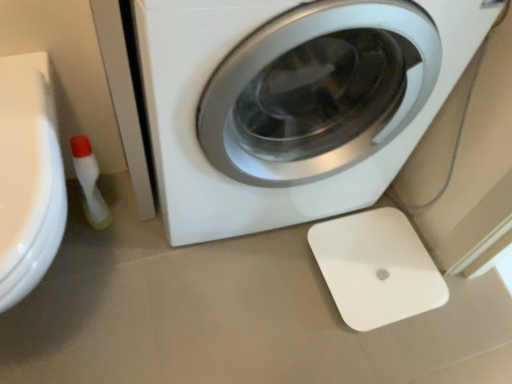
Identify the location of unoccupied region to the right of translucent plastic bottle at lower left. This screenshot has width=512, height=384. (151, 244).